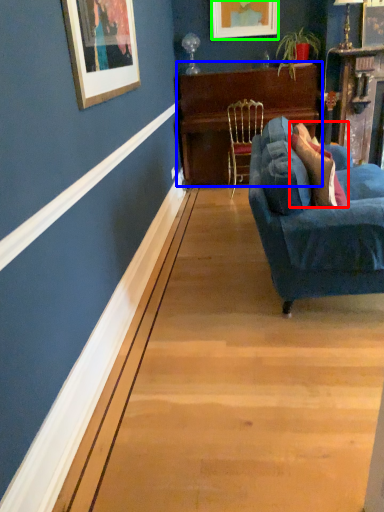
Question: Considering the real-world distances, which object is closest to pillow (highlighted by a red box)? table (highlighted by a blue box) or picture frame (highlighted by a green box).

Choices:
 (A) table
 (B) picture frame

Answer: (A)